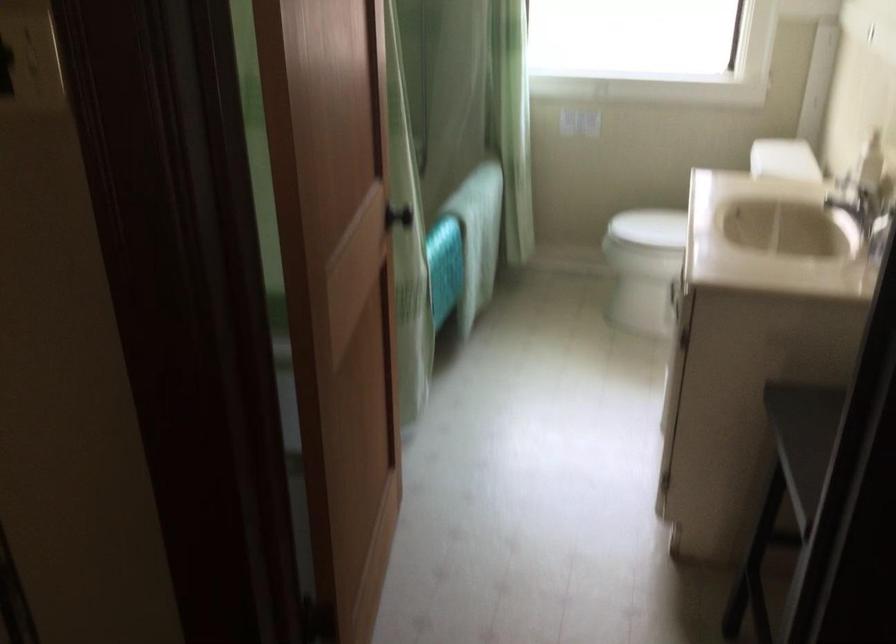
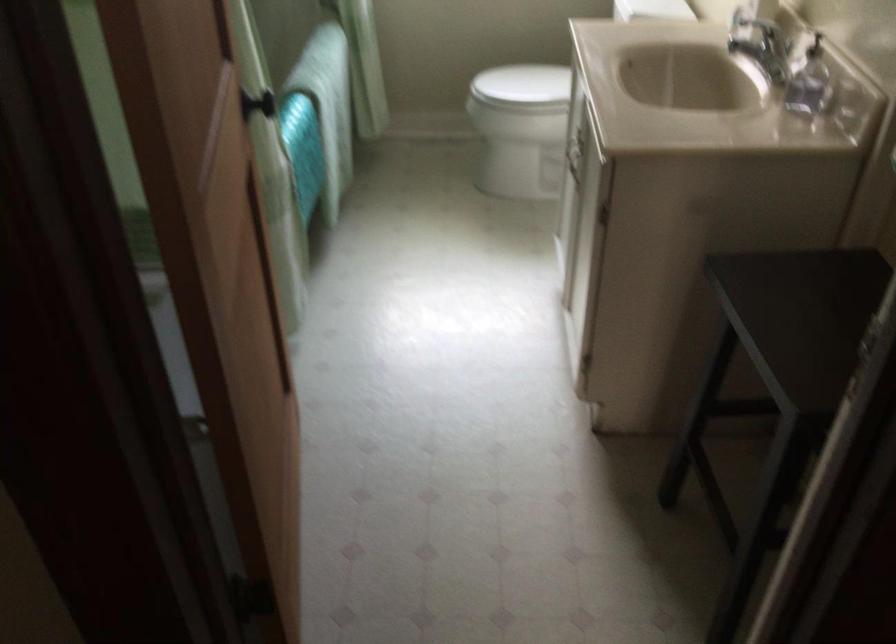
The point at (x=394, y=216) is marked in the first image. Where is the corresponding point in the second image?

(256, 104)